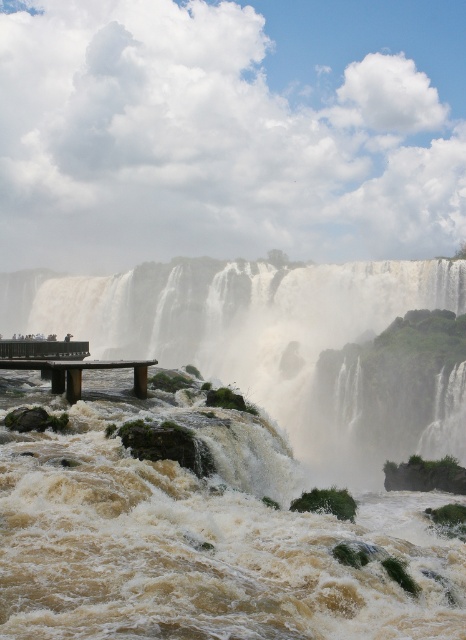
You are standing on the wooden viewing platform and want to take a photo of the waterfall. There are two points marked on your camera screen at coordinates point (143, 296) and point (93, 360). Which point is closer to you, the photographer?

Point (143, 296) is further to the viewer than point (93, 360), so the point closer to you is point (93, 360).

You are standing on the wooden viewing platform and want to take a photo of the brown frothy water at center. Where exactly should you aim your camera to capture it?

You should aim your camera at point 0.834 on the x axis and 0.427 on the y axis to capture the brown frothy water at center.

You are a photographer planning to capture the brown frothy water at center and the metallic silver bench at lower left in the same frame. Based on their sizes, which object should you focus on first to ensure both are in the shot?

The brown frothy water at center is wider than the metallic silver bench at lower left, so you should focus on the brown frothy water at center first to ensure both fit in the frame.